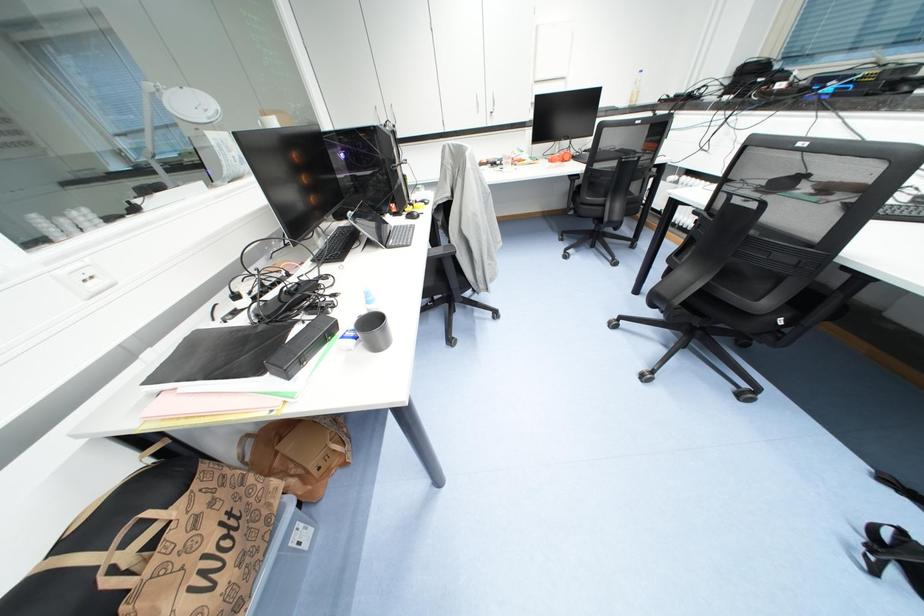
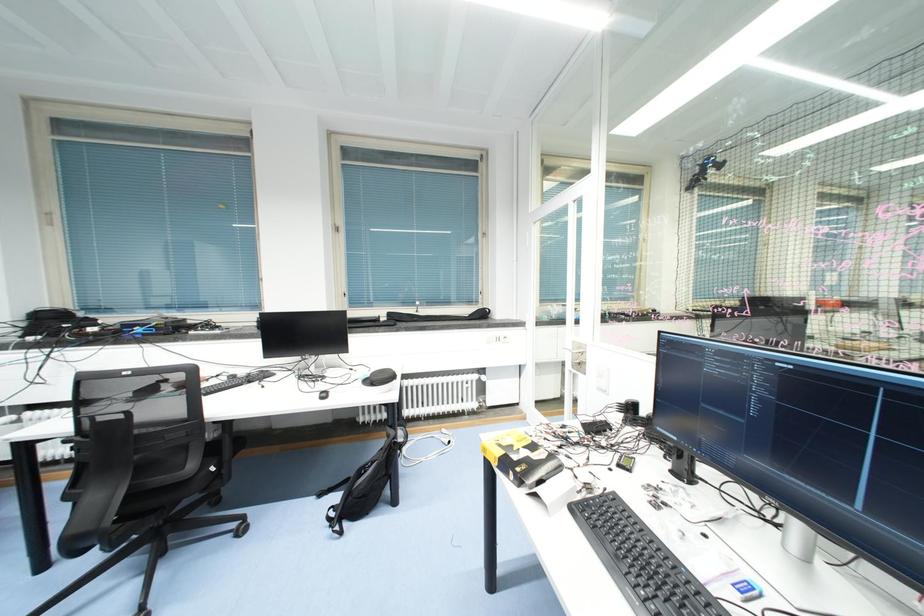
Question: The camera is either moving clockwise (left) or counter-clockwise (right) around the object. The first image is from the beginning of the video and the second image is from the end. Is the camera moving left or right when shooting the video?

Choices:
 (A) Left
 (B) Right

Answer: (A)